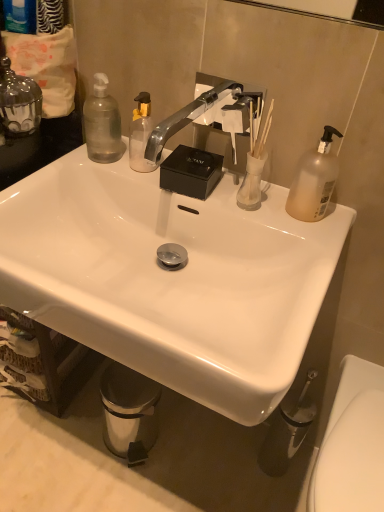
Question: Can you confirm if translucent plastic pump bottle at upper right, the 3th bottle in the left-to-right sequence, is bigger than translucent glass vase at upper right?

Choices:
 (A) yes
 (B) no

Answer: (A)

Question: From the image's perspective, is translucent plastic pump bottle at upper right, acting as the 1th bottle starting from the right, under translucent glass vase at upper right?

Choices:
 (A) yes
 (B) no

Answer: (B)

Question: Is translucent glass vase at upper right at the back of translucent plastic pump bottle at upper right, the 3th bottle in the left-to-right sequence?

Choices:
 (A) yes
 (B) no

Answer: (B)

Question: From a real-world perspective, is translucent plastic pump bottle at upper right, the 3th bottle in the left-to-right sequence, on top of translucent glass vase at upper right?

Choices:
 (A) no
 (B) yes

Answer: (B)

Question: Does translucent plastic pump bottle at upper right, the 3th bottle in the left-to-right sequence, have a smaller size compared to translucent glass vase at upper right?

Choices:
 (A) no
 (B) yes

Answer: (A)

Question: Is translucent plastic pump bottle at upper right, the 3th bottle in the left-to-right sequence, positioned beyond the bounds of translucent glass vase at upper right?

Choices:
 (A) no
 (B) yes

Answer: (B)

Question: Can you confirm if clear glass candle at upper left, the first bottle from the left, is bigger than translucent glass vase at upper right?

Choices:
 (A) no
 (B) yes

Answer: (B)

Question: Is clear glass candle at upper left, positioned as the 3th bottle in right-to-left order, shorter than translucent glass vase at upper right?

Choices:
 (A) yes
 (B) no

Answer: (B)

Question: Is clear glass candle at upper left, the first bottle from the left, positioned in front of translucent glass vase at upper right?

Choices:
 (A) no
 (B) yes

Answer: (B)

Question: From a real-world perspective, does clear glass candle at upper left, the first bottle from the left, sit lower than translucent glass vase at upper right?

Choices:
 (A) yes
 (B) no

Answer: (B)

Question: Is clear glass candle at upper left, the first bottle from the left, to the left of translucent glass vase at upper right from the viewer's perspective?

Choices:
 (A) yes
 (B) no

Answer: (A)

Question: Is clear glass candle at upper left, positioned as the 3th bottle in right-to-left order, to the right of translucent glass vase at upper right from the viewer's perspective?

Choices:
 (A) no
 (B) yes

Answer: (A)

Question: From the image's perspective, is translucent glass vase at upper right below transparent plastic bottle at upper left, arranged as the 2th bottle when viewed from the left?

Choices:
 (A) no
 (B) yes

Answer: (B)